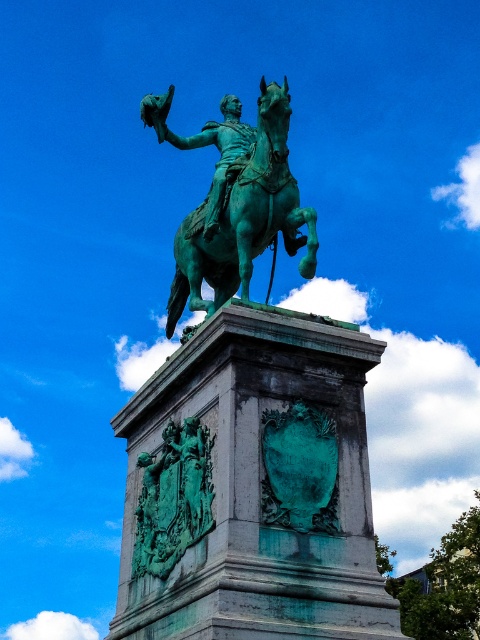
You are standing in front of the equestrian statue. Where is the green patina horse at center located in terms of coordinates?

The green patina horse at center is located at point coordinates of (244,218).

You are an art conservator assessing the statue. You need to determine if the green patina horse at center can be moved to the space currently occupied by the green patina shield at center. Based on their widths, can the horse fit into the shield area?

The green patina horse at center is wider than the green patina shield at center. Therefore, the horse cannot fit into the shield area as it exceeds the available width.